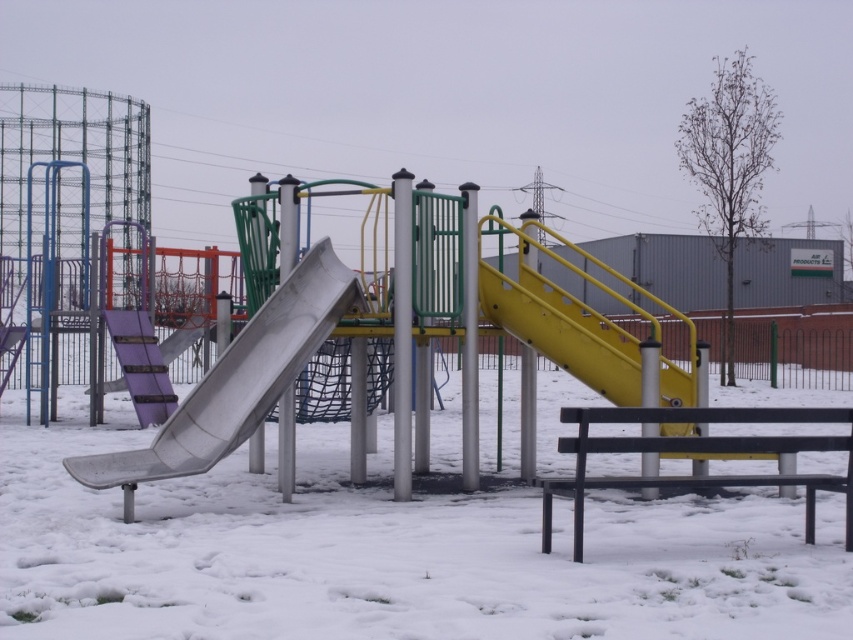
From the picture: Can you confirm if metallic smooth slide at center is bigger than yellow matte slide at center?

Yes.

How much distance is there between metallic smooth slide at center and yellow matte slide at center?

metallic smooth slide at center is 11.27 feet from yellow matte slide at center.

Locate an element on the screen. The image size is (853, 640). metallic smooth slide at center is located at coordinates (238, 378).

I want to click on metallic smooth slide at center, so click(238, 378).

Which of these two, white fluffy snow at center or yellow matte slide at center, stands taller?

white fluffy snow at center is taller.

Who is positioned more to the left, white fluffy snow at center or yellow matte slide at center?

Positioned to the left is white fluffy snow at center.

The height and width of the screenshot is (640, 853). I want to click on white fluffy snow at center, so click(x=390, y=552).

Who is more distant from viewer, (315, 340) or (201, 321)?

The point (201, 321) is behind.

You are a GUI agent. You are given a task and a screenshot of the screen. Output one action in this format:
    pyautogui.click(x=<x>, y=<y>)
    Task: Click on the metallic smooth slide at center
    
    Given the screenshot: What is the action you would take?
    pyautogui.click(x=238, y=378)

Find the location of a particular element. This screenshot has height=640, width=853. metallic smooth slide at center is located at coordinates (238, 378).